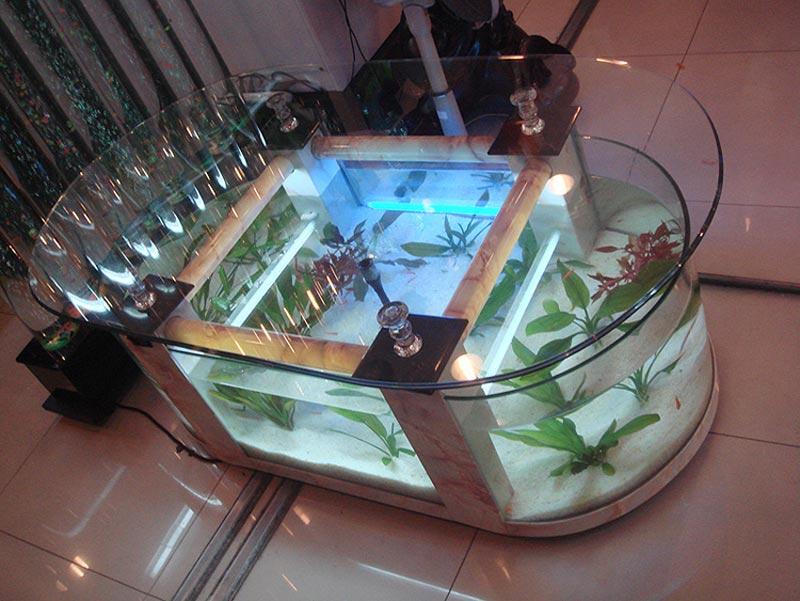
Where is `white tile floor`? Image resolution: width=800 pixels, height=601 pixels. white tile floor is located at coordinates (370, 540).